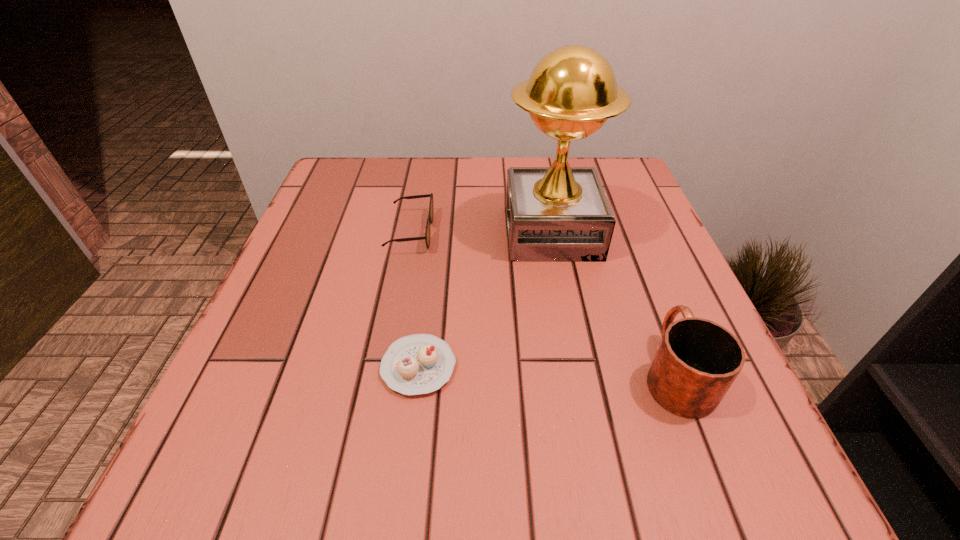
The image size is (960, 540). I want to click on vacant space that satisfies the following two spatial constraints: 1. on the front-facing side of the second shortest object; 2. on the left side of the shortest object, so click(x=385, y=367).

Image resolution: width=960 pixels, height=540 pixels. I want to click on vacant space that satisfies the following two spatial constraints: 1. on the side of the second tallest object with the handle; 2. on the front-facing side of the sunglasses, so click(x=622, y=232).

The width and height of the screenshot is (960, 540). Identify the location of vacant space that satisfies the following two spatial constraints: 1. on the side of the third shortest object with the handle; 2. on the front-facing side of the award. (622, 233).

Locate an element on the screen. This screenshot has height=540, width=960. blank area in the image that satisfies the following two spatial constraints: 1. on the back side of the shortest object; 2. on the front-facing side of the sunglasses is located at coordinates (435, 232).